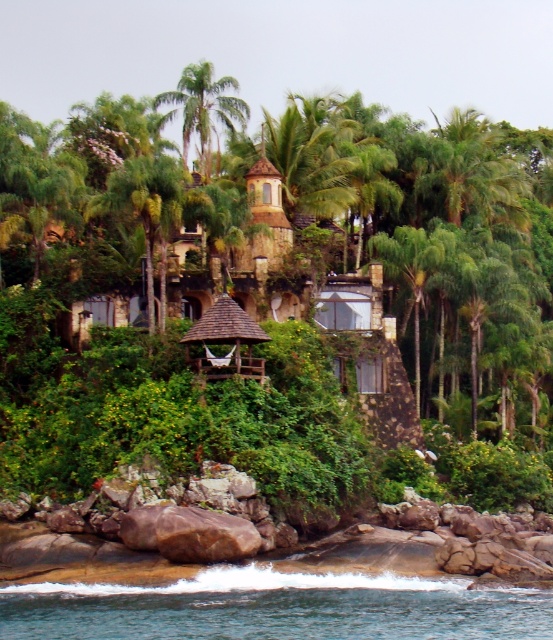
How much distance is there between rustic wood hut at center and green leafy palm tree at upper center?

rustic wood hut at center is 15.74 meters away from green leafy palm tree at upper center.

Is point (380, 264) in front of point (204, 88)?

Yes.

You are a GUI agent. You are given a task and a screenshot of the screen. Output one action in this format:
    pyautogui.click(x=<x>, y=<y>)
    Task: Click on the rustic wood hut at center
    Image resolution: width=553 pixels, height=640 pixels.
    Given the screenshot: What is the action you would take?
    pyautogui.click(x=368, y=353)

What do you see at coordinates (148, 211) in the screenshot? I see `green leafy palm tree at center` at bounding box center [148, 211].

Is point (149, 224) less distant than point (182, 128)?

Yes, it is in front of point (182, 128).

The height and width of the screenshot is (640, 553). Find the location of `green leafy palm tree at center`. green leafy palm tree at center is located at coordinates (148, 211).

Which is in front, point (343, 604) or point (163, 97)?

Point (343, 604)

Measure the distance between clear blue water at lower center and camera.

The distance of clear blue water at lower center from camera is 54.38 meters.

Identify the location of clear blue water at lower center. The width and height of the screenshot is (553, 640). (275, 609).